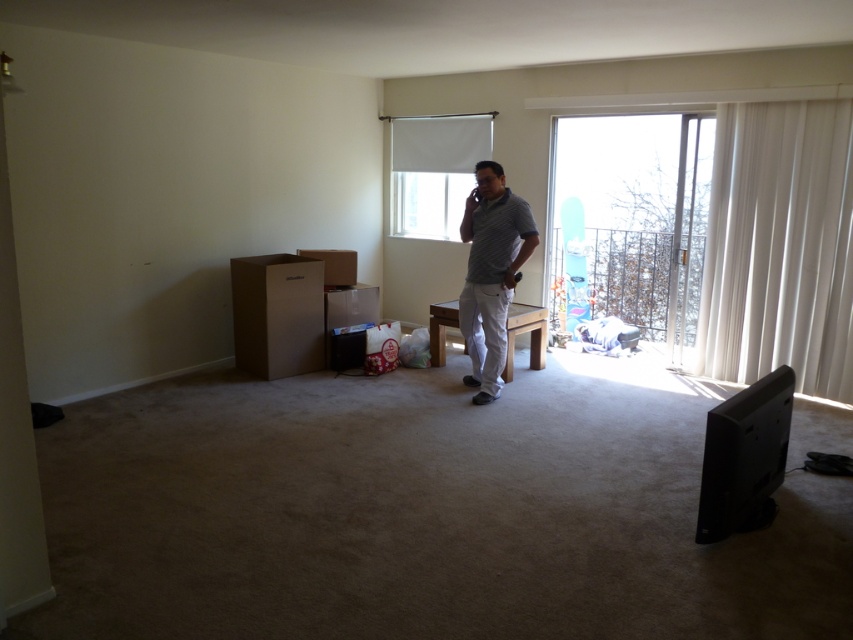
Question: Is white matte window at center thinner than matte cardboard box at center?

Choices:
 (A) no
 (B) yes

Answer: (A)

Question: Which object is the closest to the white sheer curtain at right?

Choices:
 (A) cardboard box at left
 (B) matte cardboard box at center
 (C) gray striped shirt at center
 (D) transparent glass window at right

Answer: (C)

Question: Which is nearer to the cardboard box at left?

Choices:
 (A) gray striped shirt at center
 (B) brown cardboard box at left

Answer: (B)

Question: Based on their relative distances, which object is nearer to the matte cardboard box at center?

Choices:
 (A) transparent glass window at right
 (B) white matte window at center

Answer: (B)

Question: Does white sheer curtain at right appear over cardboard box at left?

Choices:
 (A) no
 (B) yes

Answer: (B)

Question: Is transparent glass window at right below gray striped shirt at center?

Choices:
 (A) yes
 (B) no

Answer: (B)